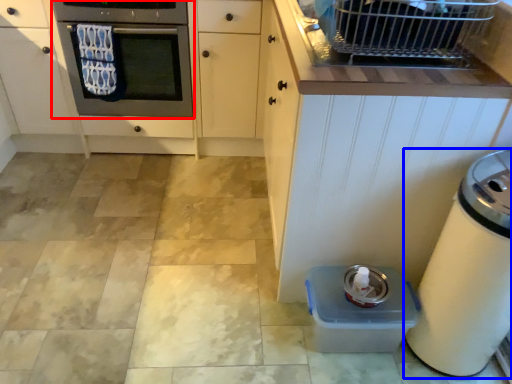
Question: Which object appears closest to the camera in this image, oven (highlighted by a red box) or home appliance (highlighted by a blue box)?

Choices:
 (A) oven
 (B) home appliance

Answer: (B)